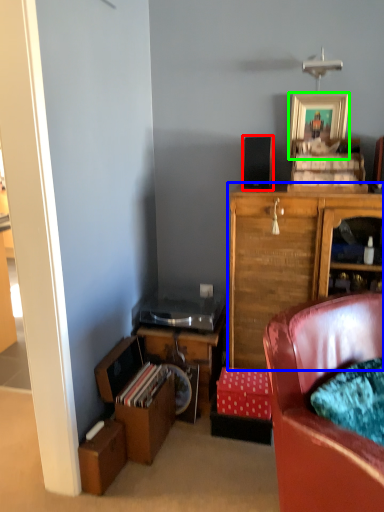
Question: Estimate the real-world distances between objects in this image. Which object is closer to loudspeaker (highlighted by a red box), cabinetry (highlighted by a blue box) or picture frame (highlighted by a green box)?

Choices:
 (A) cabinetry
 (B) picture frame

Answer: (B)